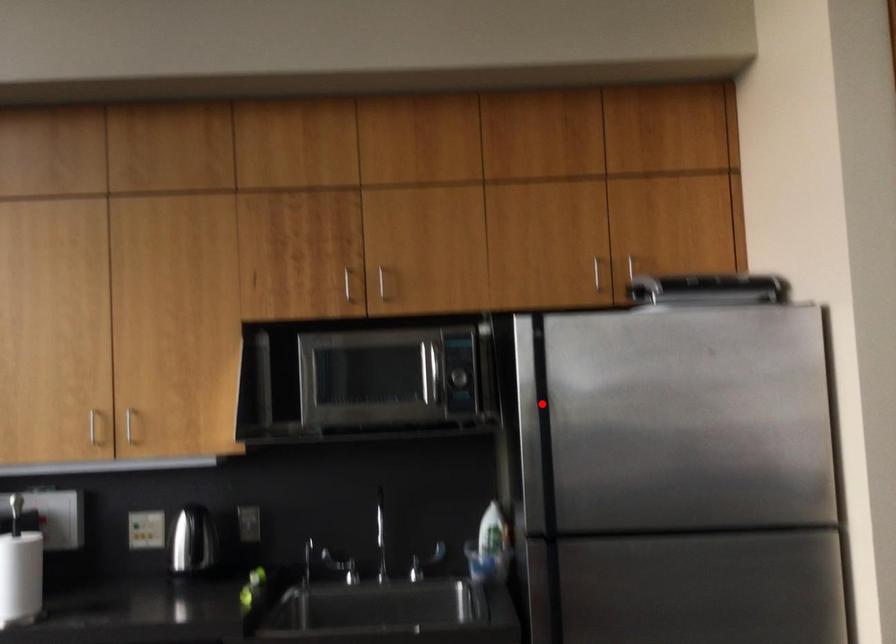
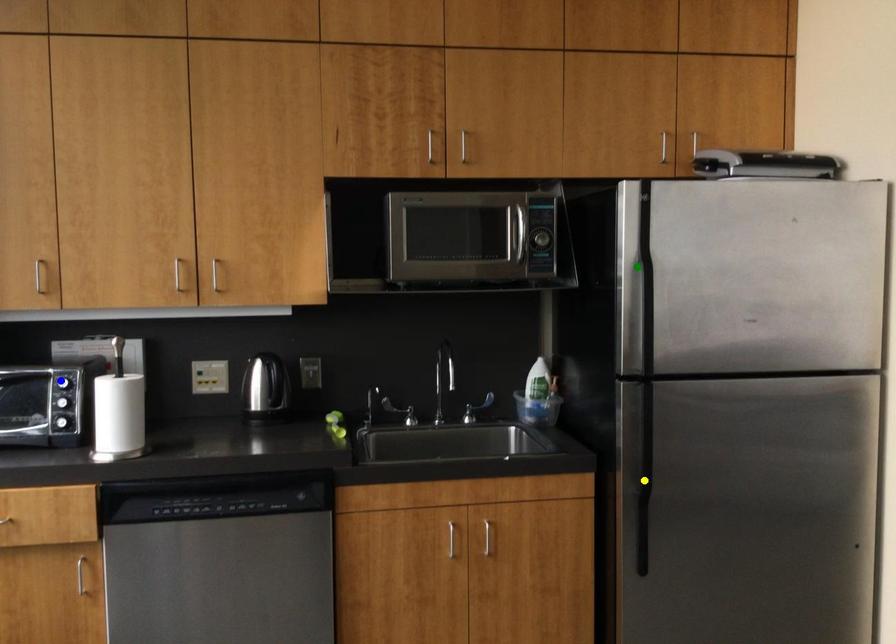
Question: I am providing you with two images of the same scene from different viewpoints. A red point is marked on the first image. You are given multiple points on the second image. Which point in image 2 is actually the same real-world point as the red point in image 1?

Choices:
 (A) green point
 (B) blue point
 (C) yellow point

Answer: (A)